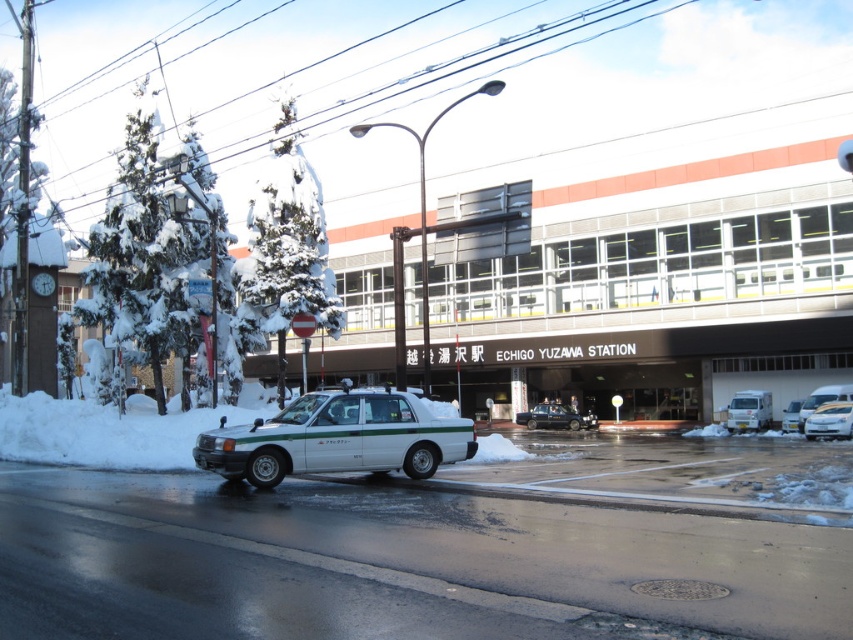
You are standing at the entrance of Echigo Yuzawa Station and want to hail a ride. The white taxi with green stripes is parked on the road. Where is the white taxi with green stripes located relative to the point marked at coordinate point (749,410)?

The white taxi with green stripes is located to the left of the point marked at coordinate point (749,410).

You are a photographer trying to capture both the white glossy sedan at center and the white matte sedan at center in a single shot. Since you want to include the station signage in the background, which sedan should you position closer to the camera to ensure both cars and the station are in focus?

You should position the white glossy sedan at center closer to the camera because it is to the left of the white matte sedan at center, so moving it forward will keep both cars and the station in focus while maintaining depth of field.